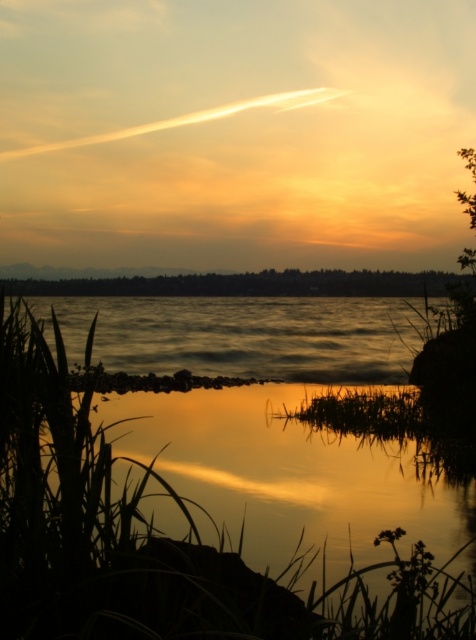
Between golden reflective water at lower center and shiny reflective water at center, which one has less height?

golden reflective water at lower center is shorter.

Can you confirm if golden reflective water at lower center is bigger than shiny reflective water at center?

Incorrect, golden reflective water at lower center is not larger than shiny reflective water at center.

This screenshot has height=640, width=476. What do you see at coordinates (195, 540) in the screenshot? I see `golden reflective water at lower center` at bounding box center [195, 540].

This screenshot has width=476, height=640. I want to click on golden reflective water at lower center, so click(195, 540).